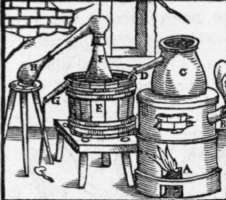
You are a GUI agent. You are given a task and a screenshot of the screen. Output one action in this format:
    pyautogui.click(x=<x>, y=<y>)
    Task: Click on the table legs
    This screenshot has height=200, width=226.
    Given the screenshot: What is the action you would take?
    pyautogui.click(x=83, y=175)